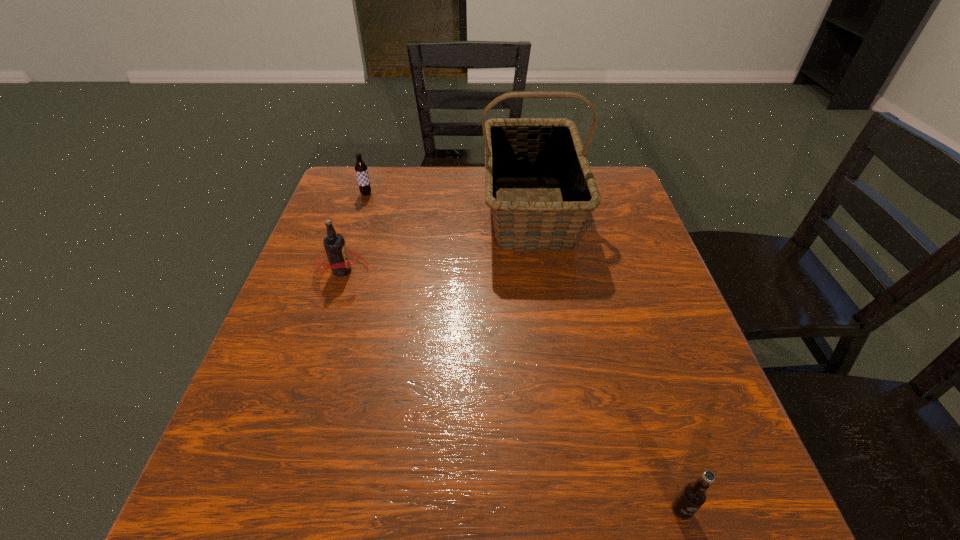
Find the location of a particular element. The height and width of the screenshot is (540, 960). free point at the right edge is located at coordinates (680, 334).

In the image, there is a desktop. At what (x,y) coordinates should I click in order to perform the action: click on free space at the far left corner. Please return your answer as a coordinate pair (x, y). Looking at the image, I should click on (358, 209).

In the image, there is a desktop. Find the location of `free space at the far right corner`. free space at the far right corner is located at coordinates (601, 188).

Find the location of a particular element. free region at the near right corner of the desktop is located at coordinates (660, 508).

Where is `vacant region between the farthest root beer and the rightmost root beer`? vacant region between the farthest root beer and the rightmost root beer is located at coordinates (524, 352).

Identify the location of blank region between the rightmost root beer and the farthest root beer. The image size is (960, 540). (524, 352).

Find the location of a particular element. The width and height of the screenshot is (960, 540). vacant area that lies between the basket and the farthest root beer is located at coordinates (448, 202).

The width and height of the screenshot is (960, 540). In order to click on vacant point located between the farthest root beer and the second nearest root beer in this screenshot , I will do `click(354, 232)`.

This screenshot has width=960, height=540. In order to click on free space between the nearest object and the second nearest root beer in this screenshot , I will do `click(512, 390)`.

You are a GUI agent. You are given a task and a screenshot of the screen. Output one action in this format:
    pyautogui.click(x=<x>, y=<y>)
    Task: Click on the unoccupied area between the rightmost root beer and the farthest root beer
    
    Given the screenshot: What is the action you would take?
    pyautogui.click(x=524, y=352)